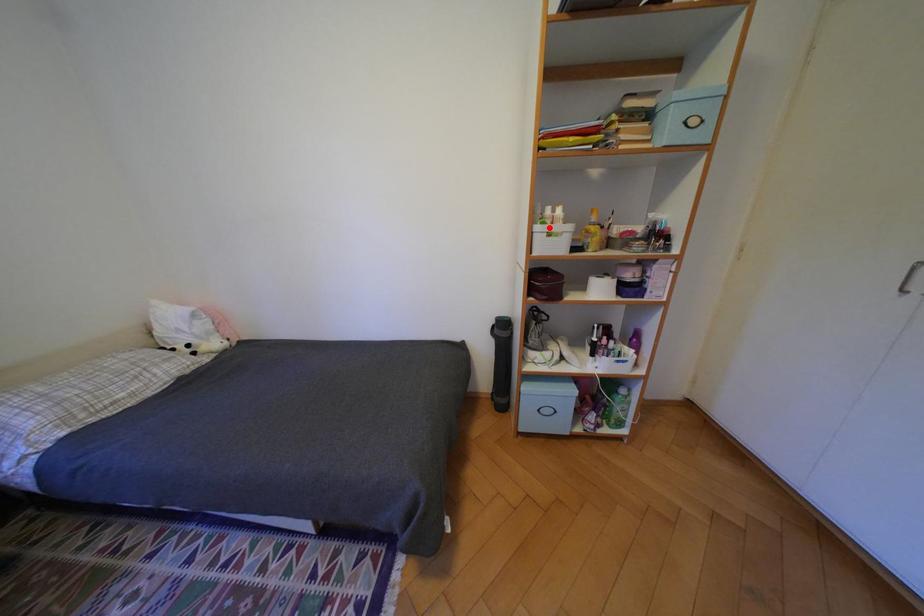
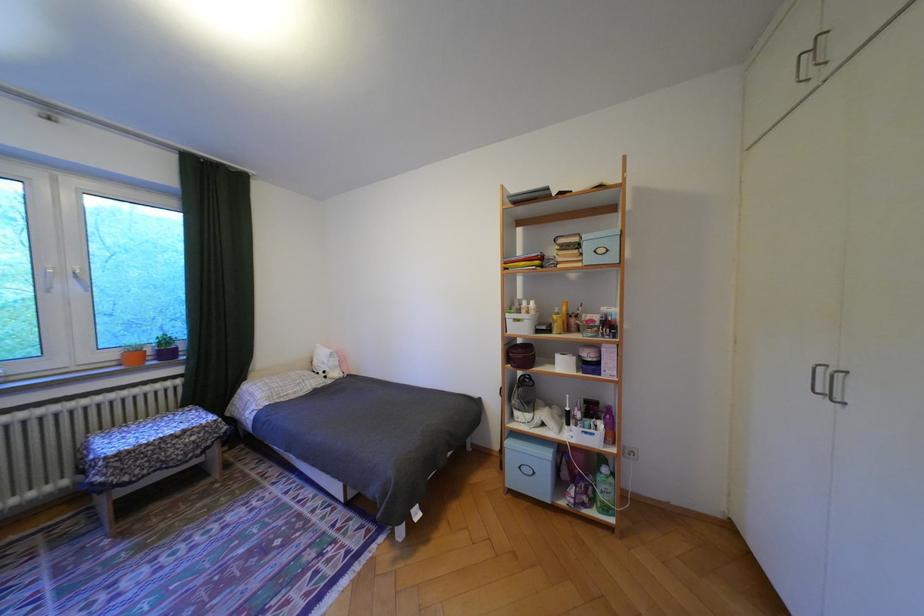
The point at the highlighted location is marked in the first image. Where is the corresponding point in the second image?

(518, 315)